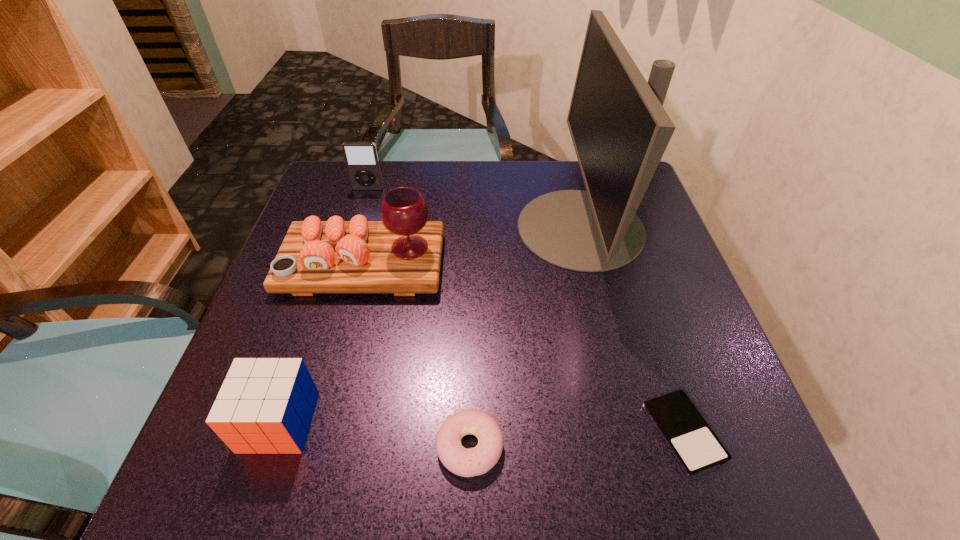
At what (x,y) coordinates should I click in order to perform the action: click on object positioned at the near right corner. Please return your answer as a coordinate pair (x, y). This screenshot has width=960, height=540. Looking at the image, I should click on (696, 447).

Locate an element on the screen. The width and height of the screenshot is (960, 540). free space at the far edge of the desktop is located at coordinates (417, 165).

You are a GUI agent. You are given a task and a screenshot of the screen. Output one action in this format:
    pyautogui.click(x=<x>, y=<y>)
    Task: Click on the vacant area at the near edge of the desktop
    
    Given the screenshot: What is the action you would take?
    pyautogui.click(x=425, y=455)

This screenshot has width=960, height=540. I want to click on vacant region at the left edge of the desktop, so click(348, 217).

The image size is (960, 540). In order to click on vacant space at the right edge of the desktop in this screenshot , I will do `click(665, 353)`.

At what (x,y) coordinates should I click in order to perform the action: click on free space at the far left corner of the desktop. Please return your answer as a coordinate pair (x, y). Looking at the image, I should click on (352, 191).

Find the location of a particular element. The width and height of the screenshot is (960, 540). vacant point at the near left corner is located at coordinates (287, 484).

Locate an element on the screen. This screenshot has height=540, width=960. vacant space at the near right corner of the desktop is located at coordinates (734, 469).

Locate an element on the screen. free space between the fifth tallest object and the cube is located at coordinates (374, 434).

This screenshot has height=540, width=960. Identify the location of vacant area that lies between the third tallest object and the shorter iPod. (526, 311).